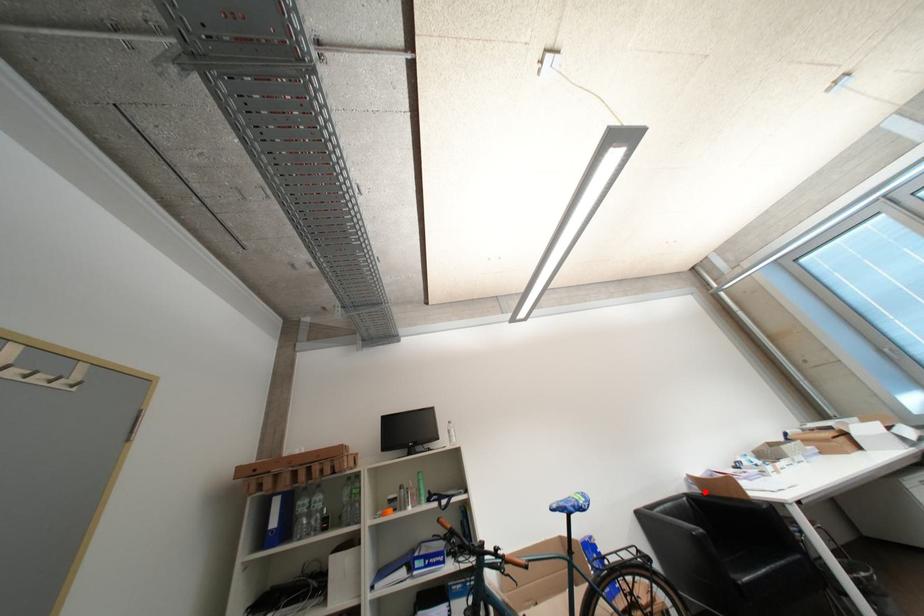
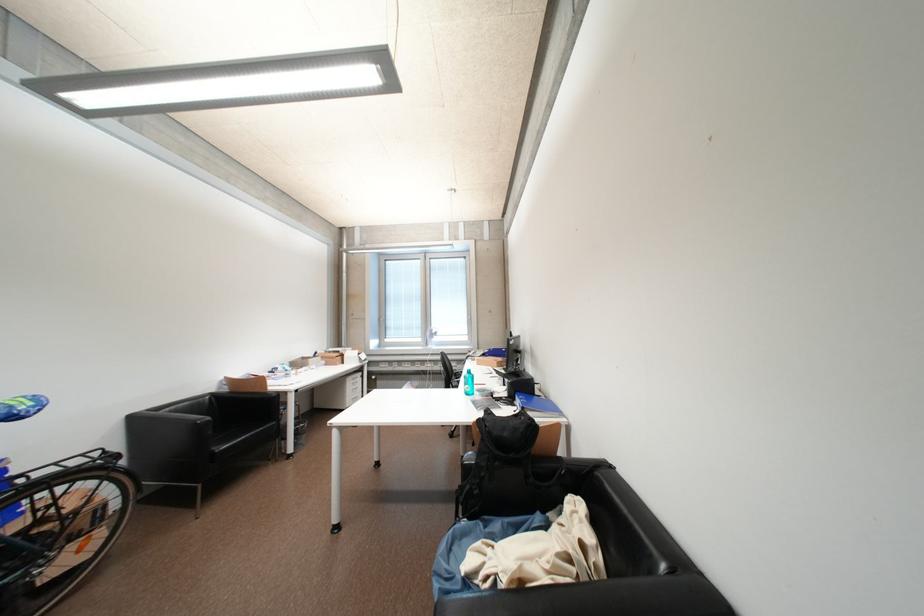
Find the pixel in the second image that matches the highlighted location in the first image.

(234, 391)